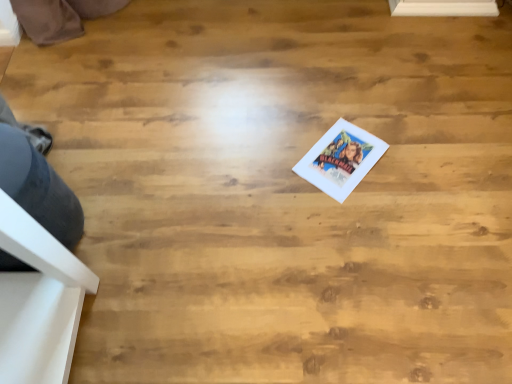
I want to click on free point to the right of matte paper postcard at center, so [x=410, y=160].